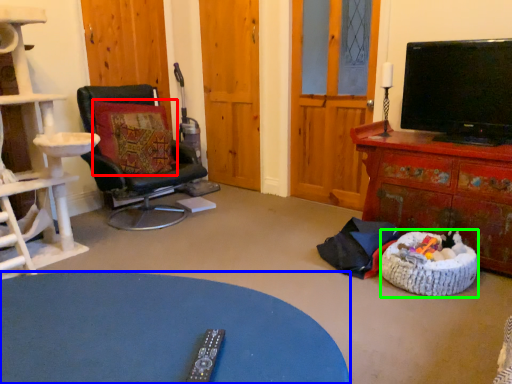
Question: Based on their relative distances, which object is nearer to pillow (highlighted by a red box)? Choose from desk (highlighted by a blue box) and dog bed (highlighted by a green box).

Choices:
 (A) desk
 (B) dog bed

Answer: (B)